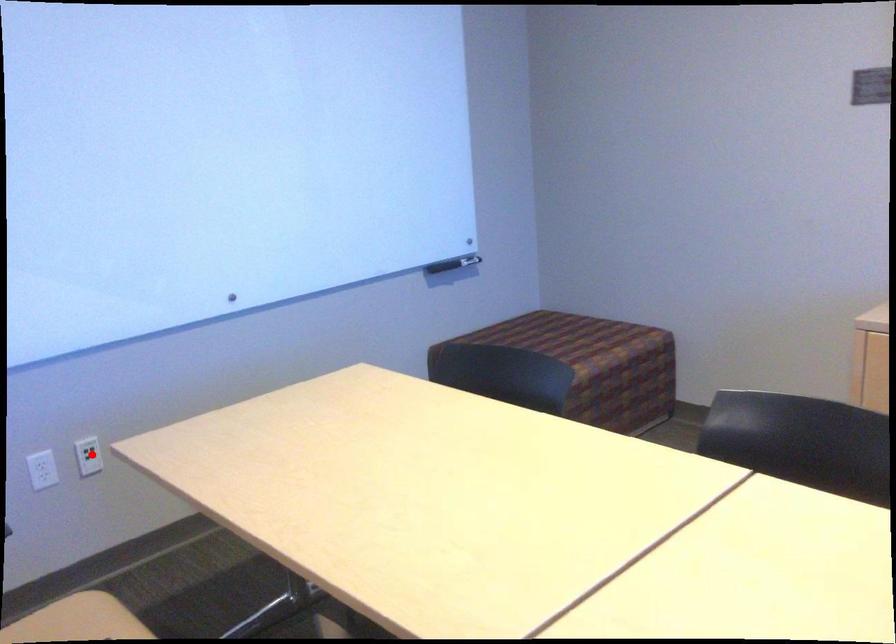
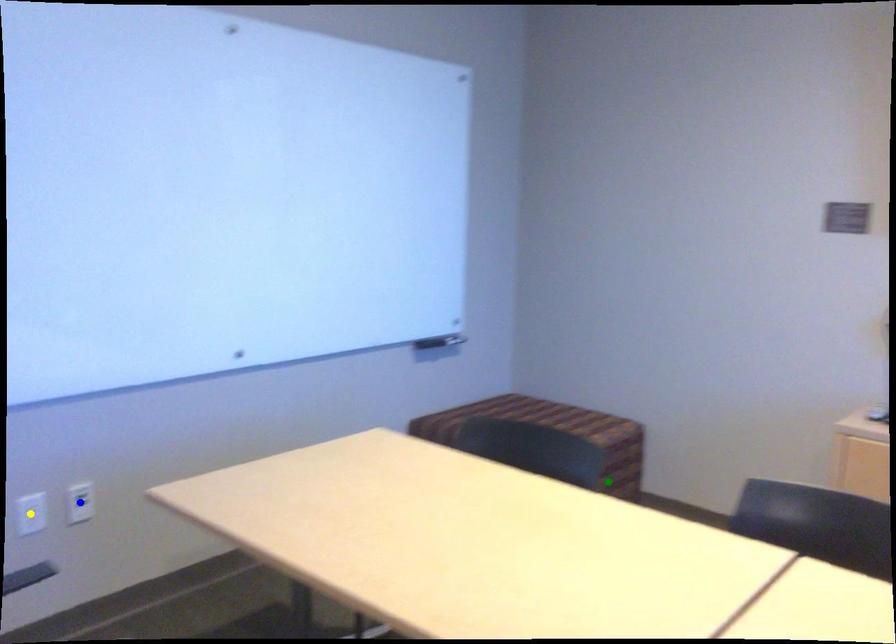
Question: I am providing you with two images of the same scene from different viewpoints. A red point is marked on the first image. You are given multiple points on the second image. Which mark in image 2 goes with the point in image 1?

Choices:
 (A) blue point
 (B) green point
 (C) yellow point

Answer: (A)